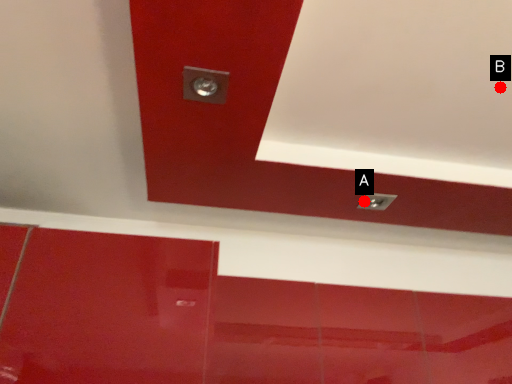
Question: Two points are circled on the image, labeled by A and B beside each circle. Which point is further to the camera?

Choices:
 (A) A is further
 (B) B is further

Answer: (A)